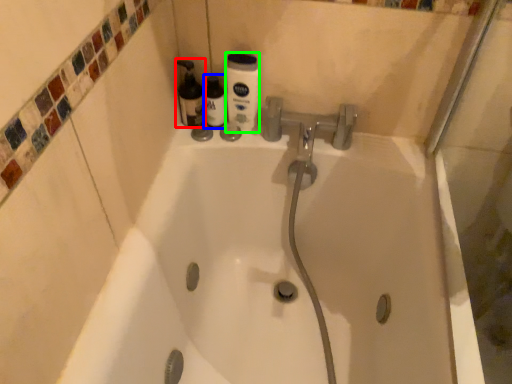
Question: Which object is positioned closest to cleaning product (highlighted by a red box)? Select from bottle (highlighted by a blue box) and cleaning product (highlighted by a green box).

Choices:
 (A) bottle
 (B) cleaning product

Answer: (A)